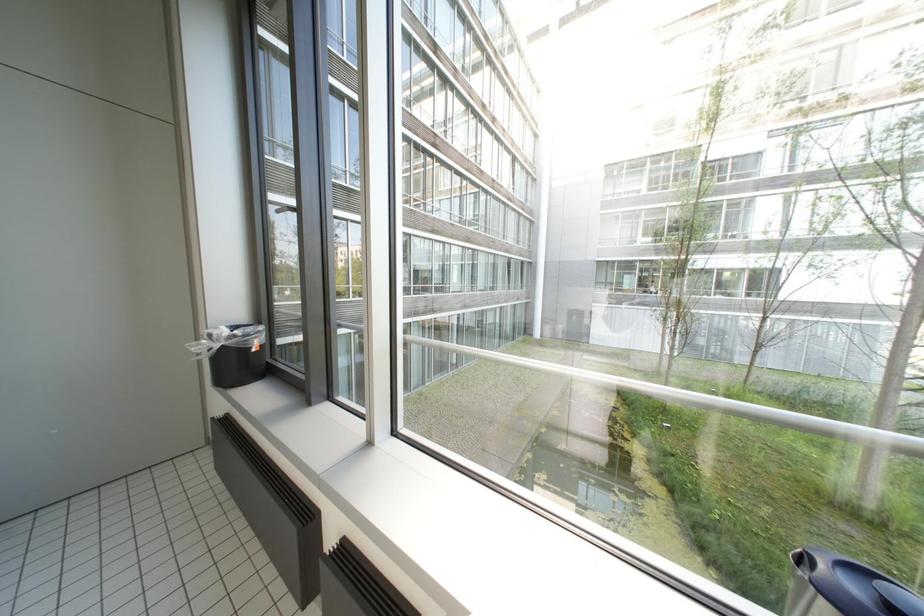
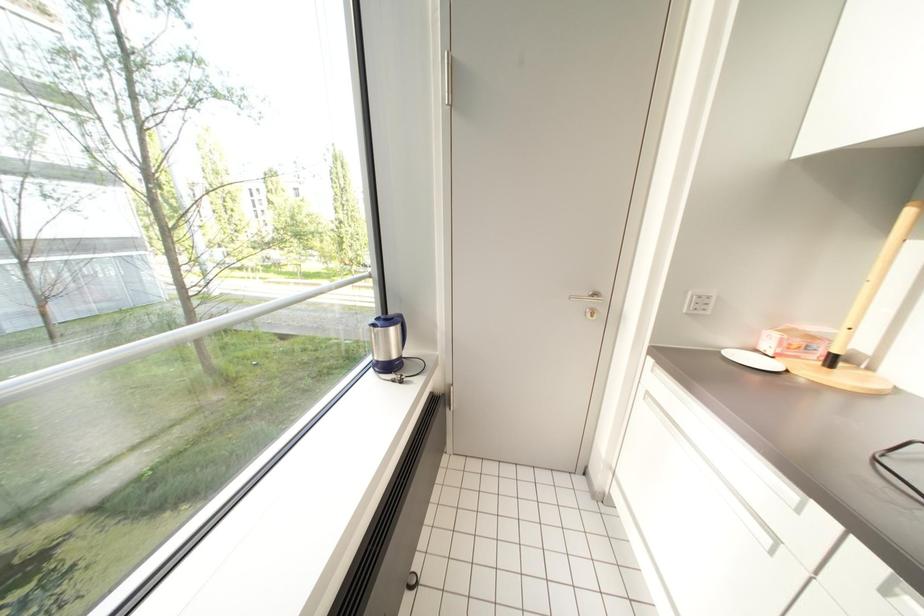
How did the camera likely rotate?

The camera's rotation is toward right-down.